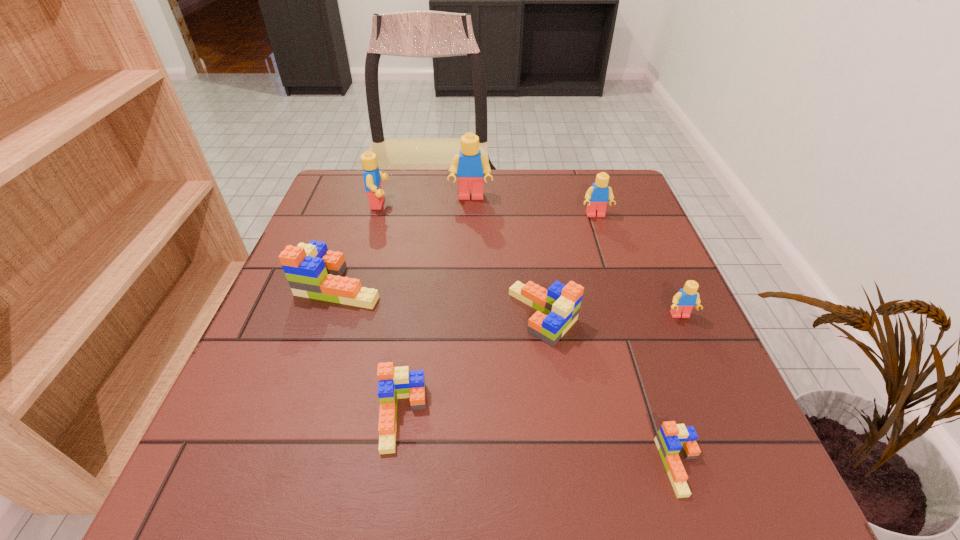
Locate an element on the screen. This screenshot has height=540, width=960. the biggest yellow Lego is located at coordinates (469, 166).

Find the location of a particular element. This screenshot has width=960, height=540. the tallest Lego is located at coordinates (469, 166).

Image resolution: width=960 pixels, height=540 pixels. I want to click on the third smallest yellow Lego, so click(372, 176).

Where is `the leftmost yellow Lego`? the leftmost yellow Lego is located at coordinates coord(372,176).

Locate an element on the screen. This screenshot has height=540, width=960. the third biggest yellow Lego is located at coordinates (597, 196).

Where is `the leftmost orange Lego`? the leftmost orange Lego is located at coordinates (312, 271).

Locate an element on the screen. The image size is (960, 540). the second biggest orange Lego is located at coordinates (558, 307).

Locate an element on the screen. the third orange Lego from left to right is located at coordinates (558, 307).

Find the location of a particular element. This screenshot has height=540, width=960. the rightmost object is located at coordinates (684, 301).

Locate an element on the screen. the rightmost yellow Lego is located at coordinates (684, 301).